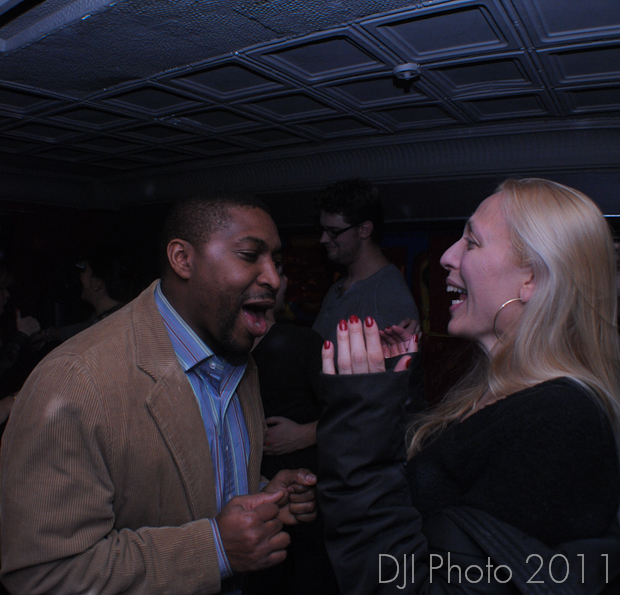
At what (x,y) coordinates should I click in order to perform the action: click on ceiling. Please return your answer as a coordinate pair (x, y). This screenshot has height=595, width=620. Looking at the image, I should click on (421, 81).